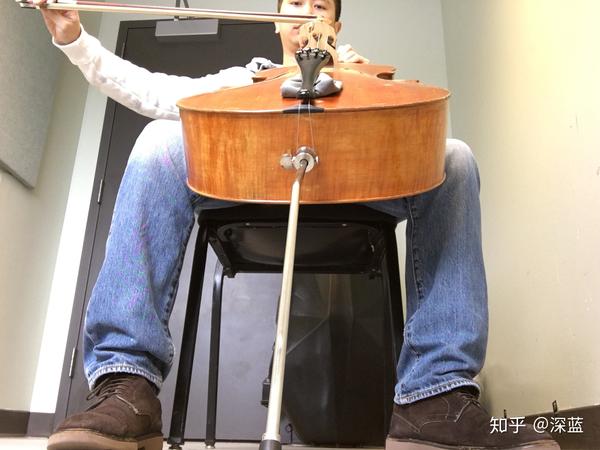
Identify the location of door hinge. The image size is (600, 450). (98, 194), (72, 360), (121, 49).